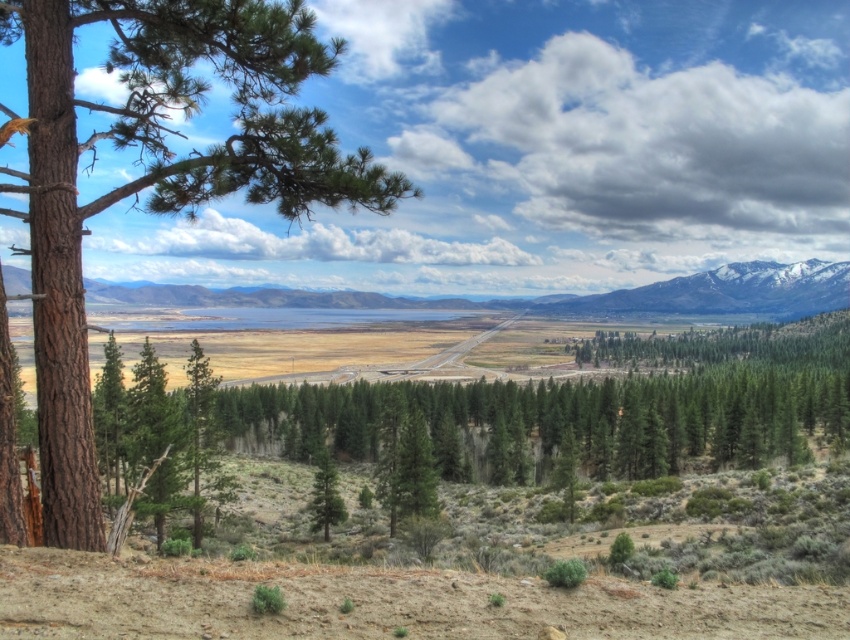
Question: Does snowy granite mountain at upper right appear on the left side of green matte tree at center?

Choices:
 (A) no
 (B) yes

Answer: (A)

Question: Which of the following is the closest to the observer?

Choices:
 (A) (196, 525)
 (B) (656, 298)
 (C) (174, 17)

Answer: (C)

Question: Where is brown rough bark tree at left located in relation to snowy granite mountain at upper right in the image?

Choices:
 (A) below
 (B) above

Answer: (B)

Question: Estimate the real-world distances between objects in this image. Which object is closer to the snowy granite mountain at upper right?

Choices:
 (A) brown rough bark tree at left
 (B) green matte tree at center

Answer: (A)

Question: Can you confirm if brown rough bark tree at left is positioned to the right of snowy granite mountain at upper right?

Choices:
 (A) no
 (B) yes

Answer: (A)

Question: Which point is farther from the camera taking this photo?

Choices:
 (A) (704, 298)
 (B) (217, 163)

Answer: (A)